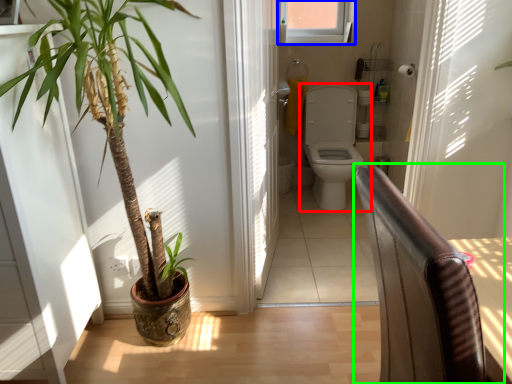
Question: Estimate the real-world distances between objects in this image. Which object is farther from toilet (highlighted by a red box), window (highlighted by a blue box) or chair (highlighted by a green box)?

Choices:
 (A) window
 (B) chair

Answer: (B)